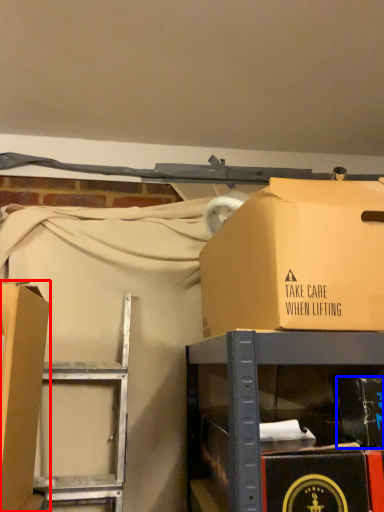
Question: Which point is closer to the camera, box (highlighted by a red box) or box (highlighted by a blue box)?

Choices:
 (A) box
 (B) box

Answer: (A)